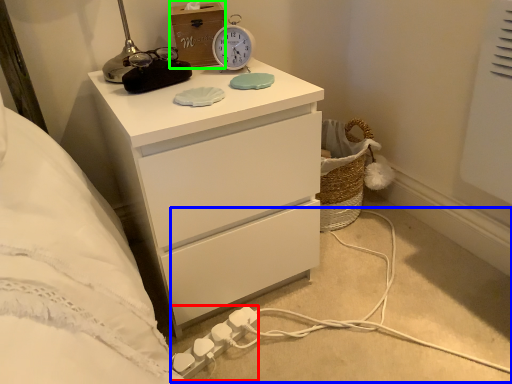
Question: Which object is the farthest from extension cord (highlighted by a red box)? Choose among these: cable (highlighted by a blue box) or box (highlighted by a green box).

Choices:
 (A) cable
 (B) box

Answer: (B)